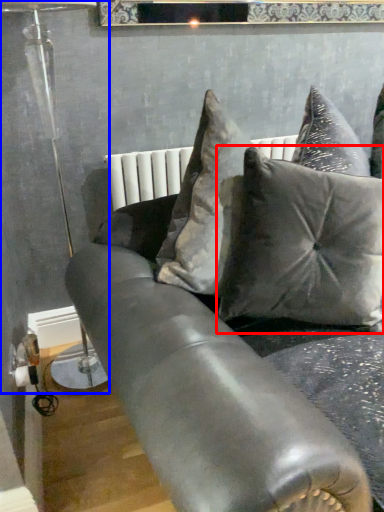
Question: Which point is closer to the camera, pillow (highlighted by a red box) or lamp (highlighted by a blue box)?

Choices:
 (A) pillow
 (B) lamp

Answer: (A)